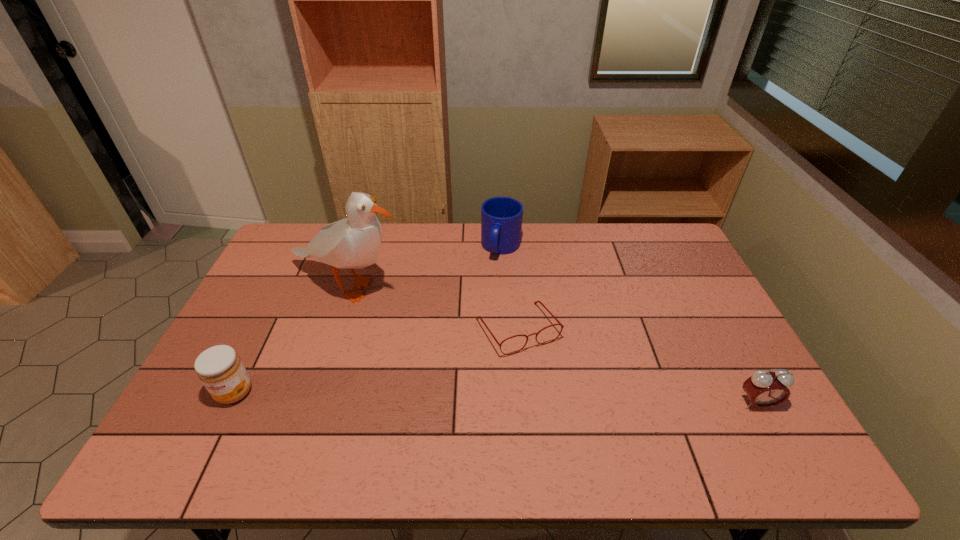
At what (x,y) coordinates should I click in order to perform the action: click on free spot between the tallest object and the mug. Please return your answer as a coordinate pair (x, y). Image resolution: width=960 pixels, height=540 pixels. Looking at the image, I should click on (424, 267).

Identify the location of free point between the alarm clock and the mug. (629, 326).

The width and height of the screenshot is (960, 540). In order to click on empty space between the shortest object and the rightmost object in this screenshot , I will do `click(637, 367)`.

You are a GUI agent. You are given a task and a screenshot of the screen. Output one action in this format:
    pyautogui.click(x=<x>, y=<y>)
    Task: Click on the free spot between the spectacles and the rightmost object
    This screenshot has width=960, height=540.
    Given the screenshot: What is the action you would take?
    click(x=637, y=367)

You are a GUI agent. You are given a task and a screenshot of the screen. Output one action in this format:
    pyautogui.click(x=<x>, y=<y>)
    Task: Click on the vacant region between the rightmost object and the mug
    The height and width of the screenshot is (540, 960).
    Given the screenshot: What is the action you would take?
    pyautogui.click(x=629, y=326)

I want to click on vacant space that is in between the rightmost object and the mug, so click(x=629, y=326).

The width and height of the screenshot is (960, 540). I want to click on unoccupied position between the mug and the tallest object, so click(424, 267).

The height and width of the screenshot is (540, 960). In order to click on free space between the spectacles and the alarm clock in this screenshot , I will do `click(637, 367)`.

You are a GUI agent. You are given a task and a screenshot of the screen. Output one action in this format:
    pyautogui.click(x=<x>, y=<y>)
    Task: Click on the vacant point located between the jam and the mug
    The height and width of the screenshot is (540, 960).
    Given the screenshot: What is the action you would take?
    pyautogui.click(x=368, y=320)

Identify the location of free spot between the mug and the rightmost object. The height and width of the screenshot is (540, 960). (629, 326).